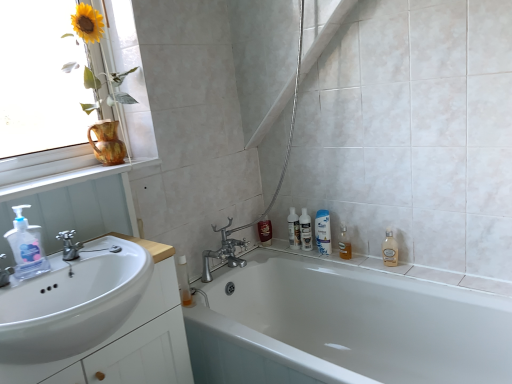
Question: Considering the relative positions of translucent plastic bottles at center, the third toiletry viewed from the left, and translucent plastic bottle at lower left in the image provided, is translucent plastic bottles at center, the third toiletry viewed from the left, to the right of translucent plastic bottle at lower left from the viewer's perspective?

Choices:
 (A) no
 (B) yes

Answer: (B)

Question: Is translucent plastic bottles at center, the third toiletry viewed from the left, taller than translucent plastic bottle at lower left?

Choices:
 (A) no
 (B) yes

Answer: (B)

Question: From a real-world perspective, does translucent plastic bottles at center, which appears as the first toiletry when viewed from the right, stand above translucent plastic bottle at lower left?

Choices:
 (A) yes
 (B) no

Answer: (A)

Question: Considering the relative sizes of translucent plastic bottles at center, the third toiletry viewed from the left, and translucent plastic bottle at lower left in the image provided, is translucent plastic bottles at center, the third toiletry viewed from the left, thinner than translucent plastic bottle at lower left?

Choices:
 (A) yes
 (B) no

Answer: (B)

Question: Does translucent plastic bottles at center, which appears as the first toiletry when viewed from the right, have a larger size compared to translucent plastic bottle at lower left?

Choices:
 (A) yes
 (B) no

Answer: (B)

Question: Is translucent plastic bottles at center, the third toiletry viewed from the left, smaller than translucent plastic bottle at lower left?

Choices:
 (A) yes
 (B) no

Answer: (A)

Question: Is white wood window sill at upper left behind white glossy mouthwash at upper right, the second mouthwash in the right-to-left sequence?

Choices:
 (A) no
 (B) yes

Answer: (A)

Question: Is white wood window sill at upper left bigger than white glossy mouthwash at upper right, the first mouthwash when ordered from left to right?

Choices:
 (A) yes
 (B) no

Answer: (A)

Question: Is white wood window sill at upper left not inside white glossy mouthwash at upper right, the second mouthwash in the right-to-left sequence?

Choices:
 (A) no
 (B) yes

Answer: (B)

Question: Considering the relative positions of white wood window sill at upper left and white glossy mouthwash at upper right, the first mouthwash when ordered from left to right, in the image provided, is white wood window sill at upper left to the left of white glossy mouthwash at upper right, the first mouthwash when ordered from left to right, from the viewer's perspective?

Choices:
 (A) no
 (B) yes

Answer: (B)

Question: Is white wood window sill at upper left shorter than white glossy mouthwash at upper right, the first mouthwash when ordered from left to right?

Choices:
 (A) no
 (B) yes

Answer: (B)

Question: Does white wood window sill at upper left turn towards white glossy mouthwash at upper right, the first mouthwash when ordered from left to right?

Choices:
 (A) no
 (B) yes

Answer: (A)

Question: Does matte ceramic vase at upper left appear on the left side of white wood window sill at upper left?

Choices:
 (A) yes
 (B) no

Answer: (A)